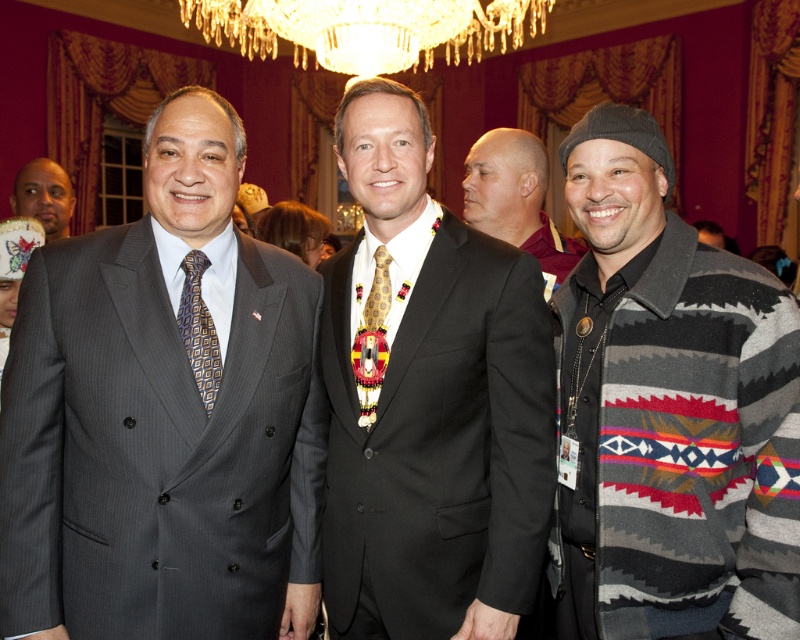
Looking at this image, can you confirm if gray pinstripe suit at left is positioned above black suit at center?

Incorrect, gray pinstripe suit at left is not positioned above black suit at center.

What do you see at coordinates (164, 419) in the screenshot? I see `gray pinstripe suit at left` at bounding box center [164, 419].

Is point (66, 474) positioned after point (400, 566)?

No, it is in front of (400, 566).

Where is `gray pinstripe suit at left`? gray pinstripe suit at left is located at coordinates (164, 419).

Who is taller, gray pinstripe suit at left or knit sweater at right?

knit sweater at right

Which is more to the left, gray pinstripe suit at left or knit sweater at right?

From the viewer's perspective, gray pinstripe suit at left appears more on the left side.

Is point (224, 490) closer to camera compared to point (784, 461)?

No, it is behind (784, 461).

Image resolution: width=800 pixels, height=640 pixels. What are the coordinates of `gray pinstripe suit at left` in the screenshot? It's located at (164, 419).

In the scene shown: Can you confirm if crystal glass chandelier at upper center is bigger than gold metallic tie at center?

Indeed, crystal glass chandelier at upper center has a larger size compared to gold metallic tie at center.

Does crystal glass chandelier at upper center have a lesser width compared to gold metallic tie at center?

In fact, crystal glass chandelier at upper center might be wider than gold metallic tie at center.

Where is `crystal glass chandelier at upper center`? crystal glass chandelier at upper center is located at coordinates 366,28.